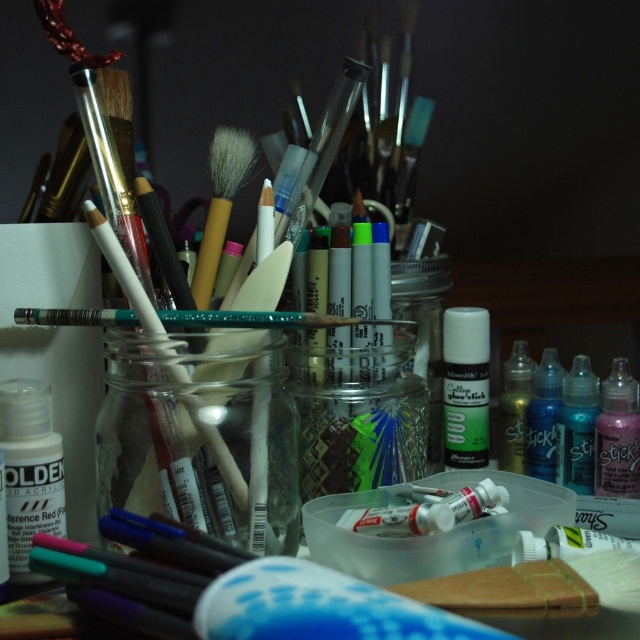
You are an artist trying to locate two specific points in your workspace. The first point is at coordinate point (620, 369) and the second is at coordinate point (588, 449). Which of these two points is closer to you?

Point (620, 369) is closer to you because it is further to the camera than point (588, 449).

You are an artist trying to reach the translucent blue liquid at lower right to finish your painting. There is a white matte glue stick at center right in the way. Can you move the glue stick to access the liquid?

The white matte glue stick at center right is closer to you than the translucent blue liquid at lower right, so you can move it to access the liquid.